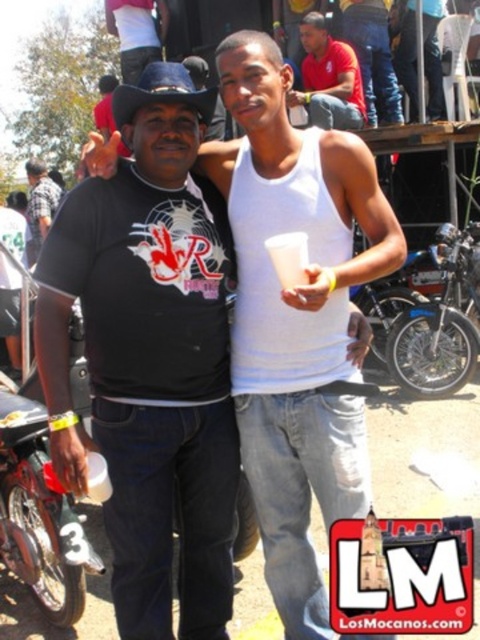
Question: Does shiny black motorcycle at left have a larger size compared to shiny chrome motorcycle at right?

Choices:
 (A) no
 (B) yes

Answer: (A)

Question: Does matte red shirt at upper center have a smaller size compared to brushed metal water at bottle left?

Choices:
 (A) yes
 (B) no

Answer: (B)

Question: Among these points, which one is nearest to the camera?

Choices:
 (A) (333, 84)
 (B) (420, 376)
 (C) (203, 428)

Answer: (C)

Question: Considering the relative positions of shiny chrome motorcycle at right and matte red shirt at upper center in the image provided, where is shiny chrome motorcycle at right located with respect to matte red shirt at upper center?

Choices:
 (A) below
 (B) above

Answer: (A)

Question: Based on their relative distances, which object is nearer to the brushed metal water at bottle left?

Choices:
 (A) shiny black motorcycle at left
 (B) matte red shirt at upper center

Answer: (B)

Question: Which point is farther from the camera taking this photo?

Choices:
 (A) (182, 211)
 (B) (460, 365)

Answer: (B)